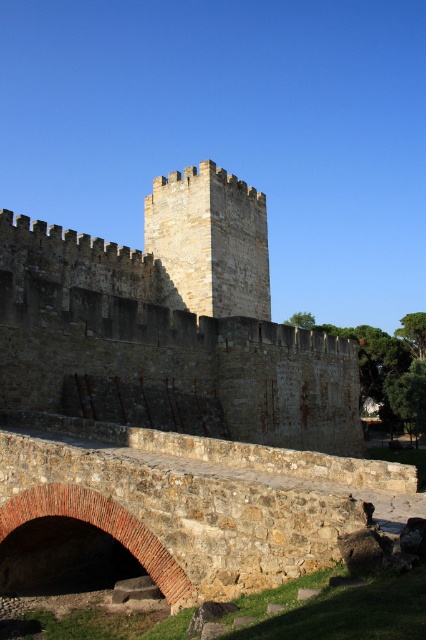
You are an architect examining the medieval fortress. You notice the stone textured tower at center and the brick archway at lower left. Which of these two structures has a greater width?

The stone textured tower at center has a greater width than the brick archway at lower left.

You are a knight approaching the fortress from the bridge. You see the stone tower at center and the brick archway at lower left. Which object is closer to your current position?

The brick archway at lower left is closer to your current position because it is located at the lower left, which is part of the bridge you are approaching from, while the stone tower at center is further ahead in the fortress area.

You are standing on the stone bridge leading to the fortress. You see the stone tower at center and the stone textured tower at center. Which tower is closer to you?

The stone tower at center is closer to the viewer than the stone textured tower at center, so the stone tower at center is closer to you.